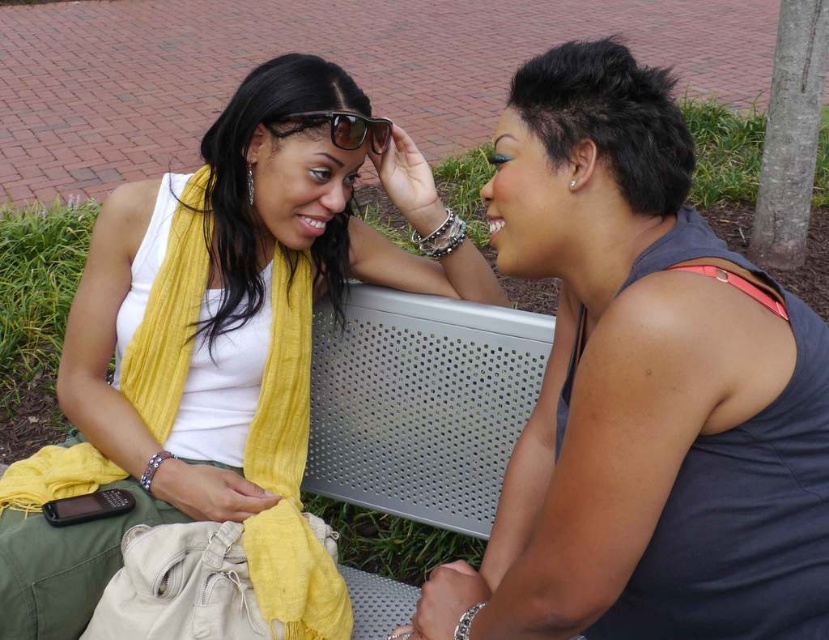
You are a photographer trying to capture a closeup of the white matte tank top at upper left and the sunglasses at center. Which object should you focus on first to ensure it appears sharp in the photo?

The white matte tank top at upper left is closer to the viewer than the sunglasses at center, so you should focus on the white matte tank top at upper left first to ensure it appears sharp.

You are a photographer trying to capture a candid shot of the two people on the perforated metal bench. You want to ensure that both the dark blue tank top at center and the sunglasses at center are clearly visible in the frame. Based on their positions, which object should you focus on first to ensure both are in focus?

The dark blue tank top at center is to the right of sunglasses at center, so focusing on the sunglasses at center first will ensure both are in focus since they are closer to the camera.